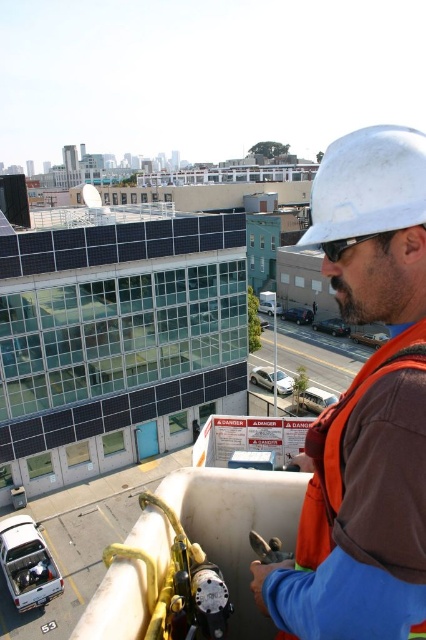
Who is positioned more to the left, white hard hat at upper right or white matte hard hat at upper right?

Positioned to the left is white hard hat at upper right.

Where is `white hard hat at upper right`? white hard hat at upper right is located at coordinates (365, 408).